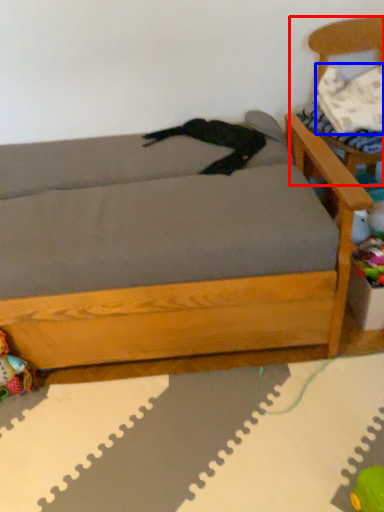
Question: Which object is closer to the camera taking this photo, armchair (highlighted by a red box) or pillow (highlighted by a blue box)?

Choices:
 (A) armchair
 (B) pillow

Answer: (A)